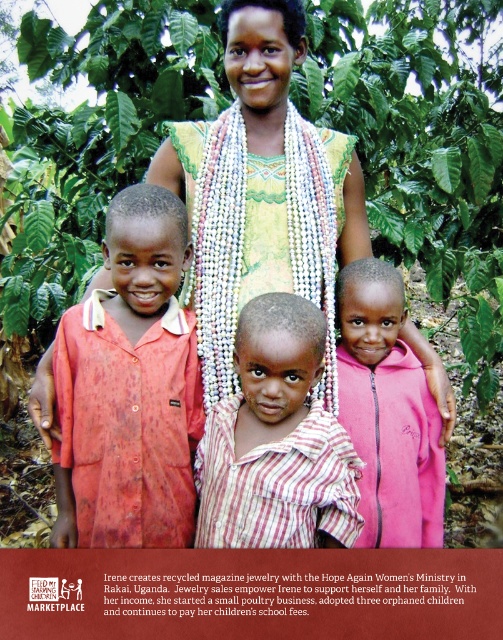
You are a photographer trying to capture a group photo of the matte red shirt at center and the pink fleece jacket at lower right. Since you want to ensure both subjects are in focus, you need to know which one is taller. Can you determine which of the two is taller?

The matte red shirt at center is taller than the pink fleece jacket at lower right according to the description, so the photographer should adjust the camera angle to account for the height difference to ensure both are in focus.

Consider the image. You are a photographer trying to capture the matte red shirt at center in your frame. Based on the coordinates provided, where should you position your camera relative to the other elements in the scene?

The matte red shirt at center is located at point coordinates, so position your camera to focus on that specific coordinate to capture the shirt within the frame.